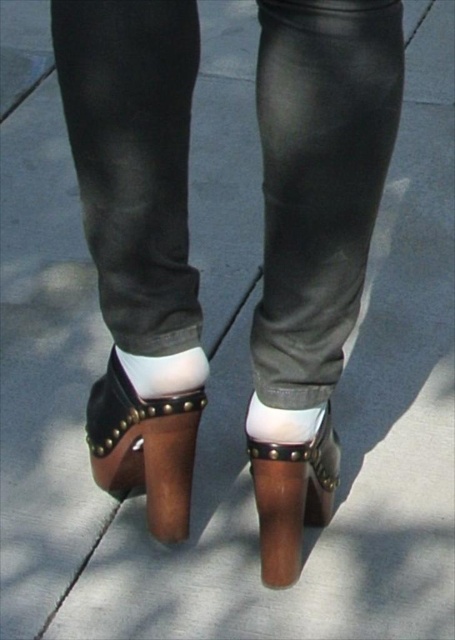
Question: Is brown leather sandal at center behind white matte sock at center?

Choices:
 (A) no
 (B) yes

Answer: (B)

Question: Is brown leather shoe at center positioned behind white matte sock at center?

Choices:
 (A) yes
 (B) no

Answer: (A)

Question: Which of these objects is positioned closest to the white matte sock at center?

Choices:
 (A) white smooth socks at center
 (B) brown leather shoe at center

Answer: (B)

Question: In this image, where is brown leather shoe at center located relative to white smooth socks at center?

Choices:
 (A) right
 (B) left

Answer: (A)

Question: Which object is farther from the camera taking this photo?

Choices:
 (A) brown leather shoe at center
 (B) white smooth socks at center
 (C) brown leather sandal at center

Answer: (C)

Question: Which of the following is the closest to the observer?

Choices:
 (A) brown leather sandal at center
 (B) white smooth socks at center

Answer: (B)